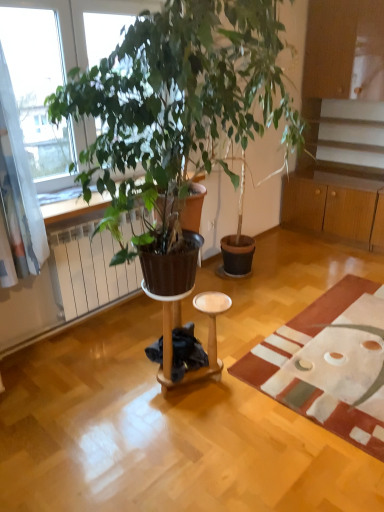
Question: From the image's perspective, does textured beige rug at lower right appear lower than wooden cabinet at right?

Choices:
 (A) yes
 (B) no

Answer: (A)

Question: From a real-world perspective, is textured beige rug at lower right positioned over wooden cabinet at right based on gravity?

Choices:
 (A) yes
 (B) no

Answer: (B)

Question: Considering the relative positions of textured beige rug at lower right and wooden cabinet at right in the image provided, is textured beige rug at lower right in front of wooden cabinet at right?

Choices:
 (A) yes
 (B) no

Answer: (A)

Question: Is textured beige rug at lower right positioned far away from wooden cabinet at right?

Choices:
 (A) yes
 (B) no

Answer: (A)

Question: From a real-world perspective, is textured beige rug at lower right below wooden cabinet at right?

Choices:
 (A) yes
 (B) no

Answer: (A)

Question: Can you confirm if textured beige rug at lower right is taller than wooden cabinet at right?

Choices:
 (A) no
 (B) yes

Answer: (A)

Question: From a real-world perspective, is wooden cabinet at right under brown matte radiator at left?

Choices:
 (A) yes
 (B) no

Answer: (B)

Question: Considering the relative sizes of wooden cabinet at right and brown matte radiator at left in the image provided, is wooden cabinet at right bigger than brown matte radiator at left?

Choices:
 (A) no
 (B) yes

Answer: (B)

Question: Is wooden cabinet at right not inside brown matte radiator at left?

Choices:
 (A) no
 (B) yes

Answer: (B)

Question: Could you tell me if wooden cabinet at right is facing brown matte radiator at left?

Choices:
 (A) no
 (B) yes

Answer: (B)

Question: Is wooden cabinet at right to the right of brown matte radiator at left from the viewer's perspective?

Choices:
 (A) yes
 (B) no

Answer: (A)

Question: Does wooden cabinet at right have a lesser height compared to brown matte radiator at left?

Choices:
 (A) yes
 (B) no

Answer: (B)

Question: Can you confirm if wooden side table at center is taller than brown matte radiator at left?

Choices:
 (A) no
 (B) yes

Answer: (A)